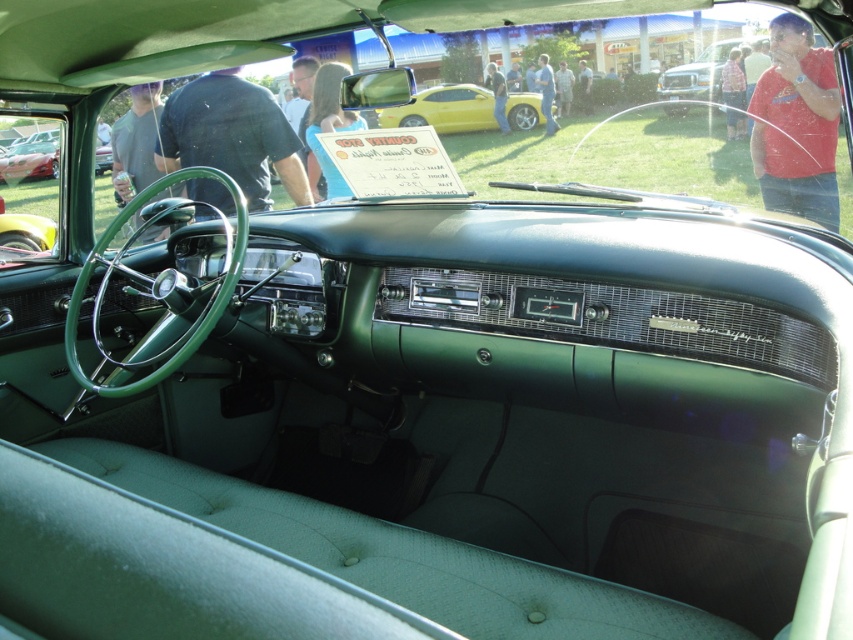
Question: Which of the following is the farthest from the observer?

Choices:
 (A) (53, 164)
 (B) (683, 104)

Answer: (A)

Question: Which point is closer to the camera taking this photo?

Choices:
 (A) (33, 136)
 (B) (532, 108)
 (C) (677, 99)

Answer: (C)

Question: Which object is farther from the camera taking this photo?

Choices:
 (A) yellow metallic car at center
 (B) metallic silver truck at upper center

Answer: (B)

Question: From the image, what is the correct spatial relationship of metallic silver truck at upper center in relation to shiny red car at left?

Choices:
 (A) left
 (B) right

Answer: (B)

Question: Can you confirm if metallic silver truck at upper center is positioned to the right of shiny red car at left?

Choices:
 (A) yes
 (B) no

Answer: (A)

Question: Does yellow metallic car at center appear under shiny red car at left?

Choices:
 (A) no
 (B) yes

Answer: (A)